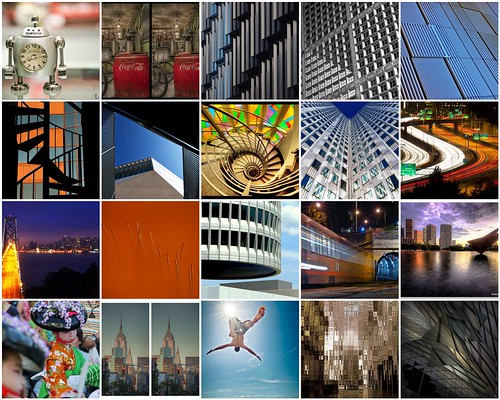
You are a GUI agent. You are given a task and a screenshot of the screen. Output one action in this format:
    pyautogui.click(x=<x>, y=<y>)
    Task: Click on the bottom row of photos
    
    Given the screenshot: What is the action you would take?
    pyautogui.click(x=71, y=358), pyautogui.click(x=155, y=355), pyautogui.click(x=253, y=350), pyautogui.click(x=372, y=360), pyautogui.click(x=461, y=354)